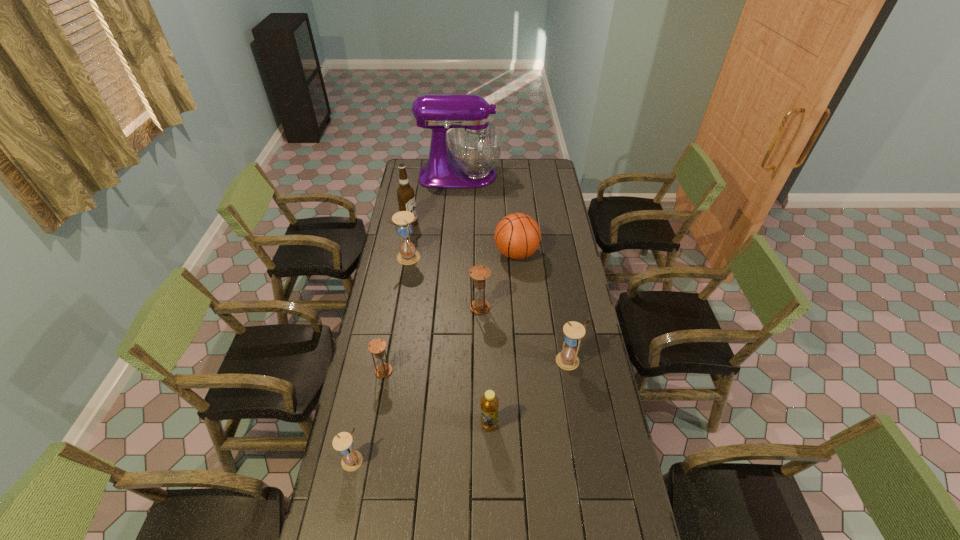
At what (x,y) coordinates should I click in order to perform the action: click on the farthest object. Please return your answer as a coordinate pair (x, y). This screenshot has width=960, height=540. Looking at the image, I should click on (475, 144).

Find the location of a particular element. The width and height of the screenshot is (960, 540). the tallest object is located at coordinates (475, 144).

Where is `the second farthest object`? the second farthest object is located at coordinates (405, 193).

Identify the location of the second tallest object. The image size is (960, 540). (405, 193).

Where is `the farthest white hourglass`? This screenshot has width=960, height=540. the farthest white hourglass is located at coordinates (408, 255).

Find the location of a particular element. This screenshot has width=960, height=540. the biggest white hourglass is located at coordinates (408, 255).

The image size is (960, 540). What are the coordinates of `basketball` in the screenshot? It's located at (517, 236).

The height and width of the screenshot is (540, 960). Find the location of `the fourth nearest hourglass`. the fourth nearest hourglass is located at coordinates (479, 273).

Image resolution: width=960 pixels, height=540 pixels. I want to click on the right brown hourglass, so click(479, 273).

Image resolution: width=960 pixels, height=540 pixels. Identify the location of the second biggest white hourglass. (567, 359).